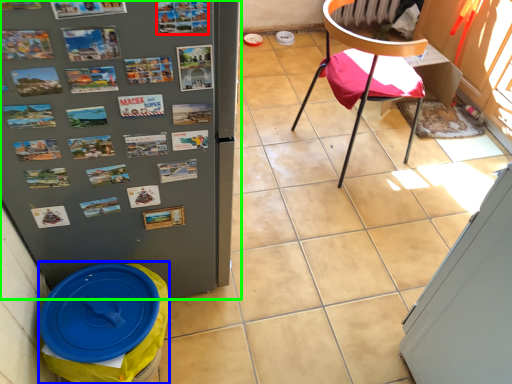
Question: Estimate the real-world distances between objects in this image. Which object is closer to poster (highlighted by a red box), garbage (highlighted by a blue box) or refrigerator (highlighted by a green box)?

Choices:
 (A) garbage
 (B) refrigerator

Answer: (B)